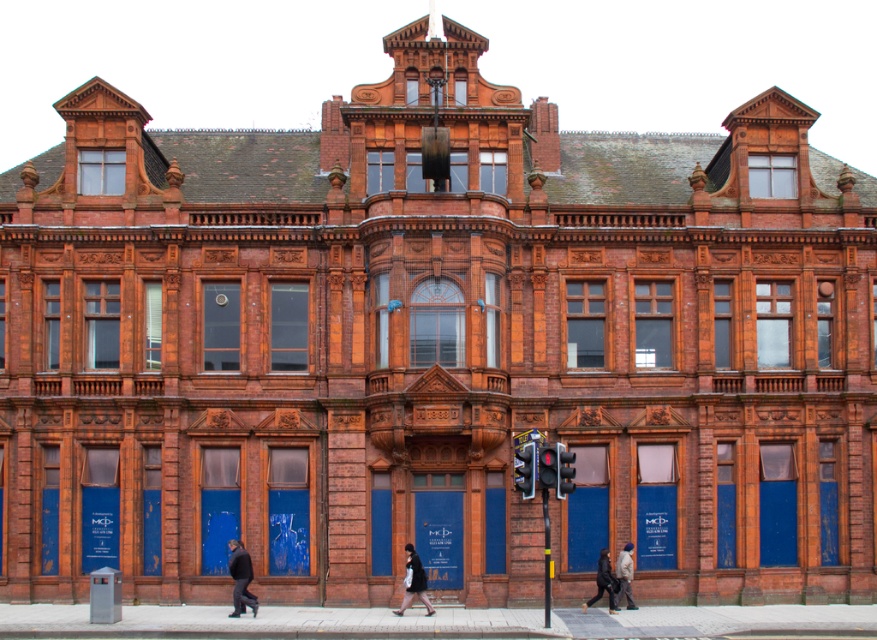
Does dark gray fabric jacket at lower left come behind dark gray woolen jacket at lower center?

No, dark gray fabric jacket at lower left is closer to the viewer.

Between dark gray fabric jacket at lower left and dark gray woolen jacket at lower center, which one appears on the left side from the viewer's perspective?

From the viewer's perspective, dark gray fabric jacket at lower left appears more on the left side.

Is point (247, 576) farther from camera compared to point (621, 593)?

No, (247, 576) is in front of (621, 593).

Find the location of a particular element. This screenshot has height=640, width=877. dark gray fabric jacket at lower left is located at coordinates (240, 579).

Between dark gray fabric jacket at lower left and dark gray fabric coat at lower center, which one appears on the left side from the viewer's perspective?

dark gray fabric jacket at lower left is more to the left.

Does dark gray fabric jacket at lower left have a greater height compared to dark gray fabric coat at lower center?

Yes, dark gray fabric jacket at lower left is taller than dark gray fabric coat at lower center.

Image resolution: width=877 pixels, height=640 pixels. I want to click on dark gray fabric jacket at lower left, so click(x=240, y=579).

I want to click on dark gray fabric jacket at lower left, so (240, 579).

I want to click on black fabric coat at center, so click(414, 580).

Is point (419, 564) more distant than point (630, 604)?

No, (419, 564) is in front of (630, 604).

Which is behind, point (416, 568) or point (617, 604)?

The point (617, 604) is behind.

Where is `black fabric coat at center`? The image size is (877, 640). black fabric coat at center is located at coordinates (414, 580).